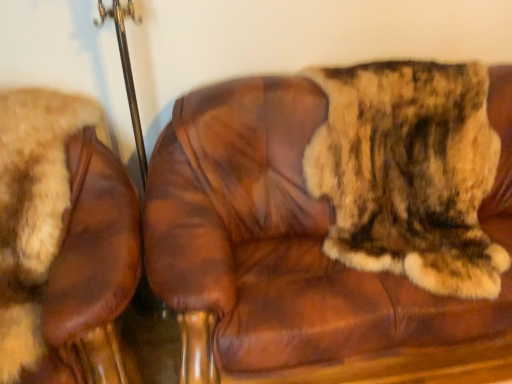
Question: Can you confirm if brown leather chair at center, the 2th chair in the left-to-right sequence, is shorter than brown leather chair at left, the 1th chair in the left-to-right sequence?

Choices:
 (A) no
 (B) yes

Answer: (A)

Question: Is brown leather chair at center, the 2th chair in the left-to-right sequence, directly adjacent to brown leather chair at left, the 1th chair in the left-to-right sequence?

Choices:
 (A) yes
 (B) no

Answer: (B)

Question: Does brown leather chair at center, which is the first chair in right-to-left order, appear on the left side of brown leather chair at left, the 1th chair in the left-to-right sequence?

Choices:
 (A) no
 (B) yes

Answer: (A)

Question: Considering the relative sizes of brown leather chair at center, the 2th chair in the left-to-right sequence, and brown leather chair at left, positioned as the second chair in right-to-left order, in the image provided, is brown leather chair at center, the 2th chair in the left-to-right sequence, taller than brown leather chair at left, positioned as the second chair in right-to-left order,?

Choices:
 (A) no
 (B) yes

Answer: (B)

Question: Is brown leather chair at center, which is the first chair in right-to-left order, positioned with its back to brown leather chair at left, positioned as the second chair in right-to-left order?

Choices:
 (A) no
 (B) yes

Answer: (A)

Question: Is brown leather chair at left, positioned as the second chair in right-to-left order, in front of or behind brown leather chair at center, the 2th chair in the left-to-right sequence, in the image?

Choices:
 (A) behind
 (B) front

Answer: (B)

Question: From a real-world perspective, is brown leather chair at left, the 1th chair in the left-to-right sequence, above or below brown leather chair at center, the 2th chair in the left-to-right sequence?

Choices:
 (A) below
 (B) above

Answer: (A)

Question: Looking at the image, does brown leather chair at left, positioned as the second chair in right-to-left order, seem bigger or smaller compared to brown leather chair at center, the 2th chair in the left-to-right sequence?

Choices:
 (A) big
 (B) small

Answer: (B)

Question: Is brown leather chair at left, the 1th chair in the left-to-right sequence, wider or thinner than brown leather chair at center, which is the first chair in right-to-left order?

Choices:
 (A) thin
 (B) wide

Answer: (B)

Question: Considering the relative positions of brown leather chair at center, the 2th chair in the left-to-right sequence, and fuzzy brown fur at right in the image provided, is brown leather chair at center, the 2th chair in the left-to-right sequence, to the left or to the right of fuzzy brown fur at right?

Choices:
 (A) left
 (B) right

Answer: (A)

Question: From a real-world perspective, is brown leather chair at center, the 2th chair in the left-to-right sequence, above or below fuzzy brown fur at right?

Choices:
 (A) below
 (B) above

Answer: (A)

Question: Is brown leather chair at center, which is the first chair in right-to-left order, bigger or smaller than fuzzy brown fur at right?

Choices:
 (A) big
 (B) small

Answer: (A)

Question: In terms of height, does brown leather chair at center, which is the first chair in right-to-left order, look taller or shorter compared to fuzzy brown fur at right?

Choices:
 (A) tall
 (B) short

Answer: (A)

Question: Is brown leather chair at center, the 2th chair in the left-to-right sequence, to the left or to the right of brown leather chair at left, the 1th chair in the left-to-right sequence, in the image?

Choices:
 (A) right
 (B) left

Answer: (A)

Question: From the image's perspective, relative to brown leather chair at left, the 1th chair in the left-to-right sequence, is brown leather chair at center, which is the first chair in right-to-left order, above or below?

Choices:
 (A) below
 (B) above

Answer: (B)